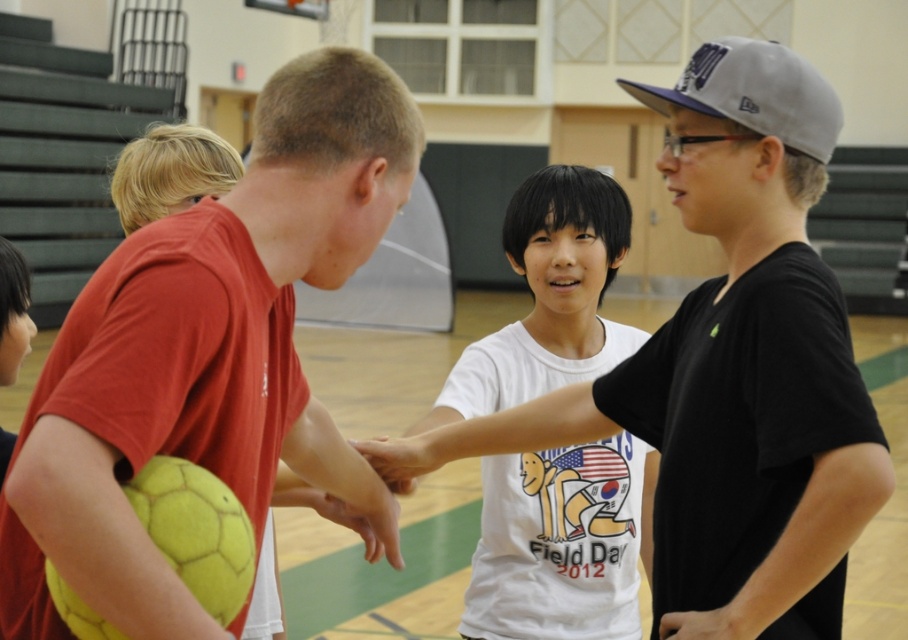
Image resolution: width=908 pixels, height=640 pixels. Identify the location of matte yellow soccer ball at left. (206, 355).

Can you confirm if white matte shirt at center is shorter than white cotton shirt at center?

Indeed, white matte shirt at center has a lesser height compared to white cotton shirt at center.

Which is in front, point (686, 492) or point (452, 372)?

Positioned in front is point (686, 492).

The width and height of the screenshot is (908, 640). In order to click on white matte shirt at center in this screenshot , I will do [x=729, y=371].

Looking at this image, can you confirm if matte yellow soccer ball at left is positioned to the right of white matte shirt at center?

In fact, matte yellow soccer ball at left is to the left of white matte shirt at center.

Where is `matte yellow soccer ball at left`? Image resolution: width=908 pixels, height=640 pixels. matte yellow soccer ball at left is located at coordinates (206, 355).

Between point (171, 397) and point (778, 337), which one is positioned behind?

The point (778, 337) is more distant.

Find the location of `matte yellow soccer ball at left`. matte yellow soccer ball at left is located at coordinates (206, 355).